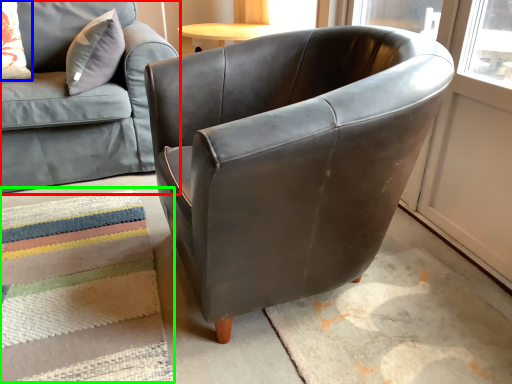
Question: Which is nearer to the studio couch (highlighted by a red box)? pillow (highlighted by a blue box) or mat (highlighted by a green box).

Choices:
 (A) pillow
 (B) mat

Answer: (A)